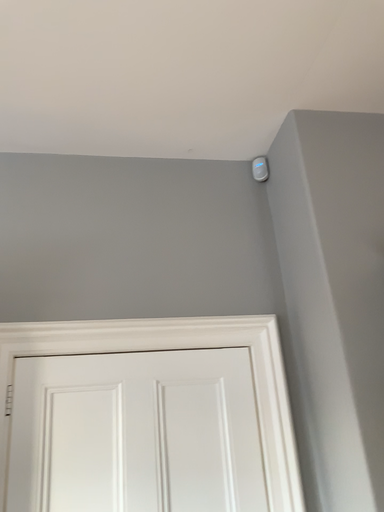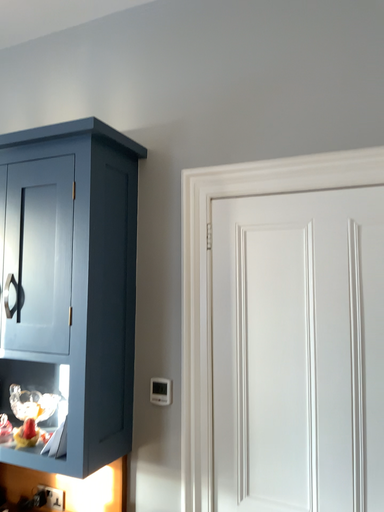
Question: Which way did the camera rotate in the video?

Choices:
 (A) rotated left
 (B) rotated right

Answer: (A)